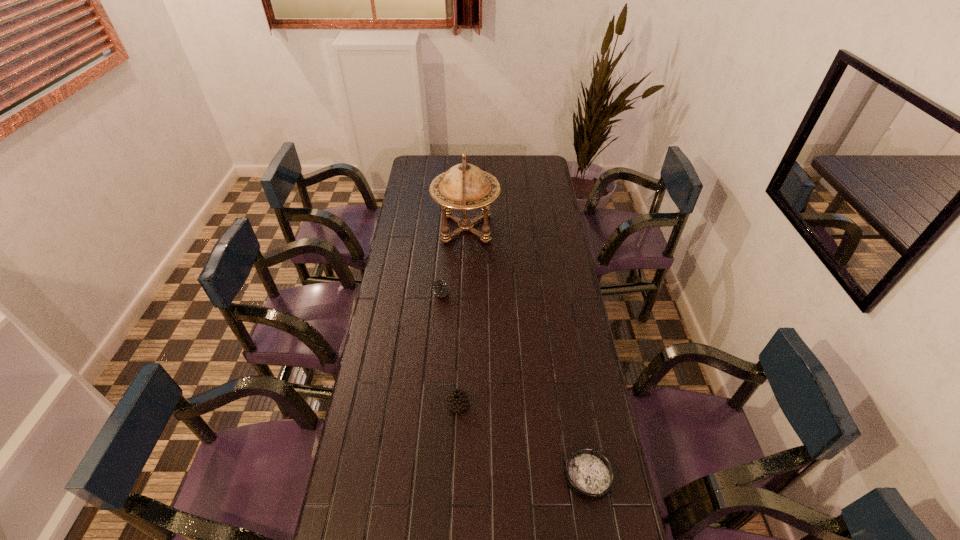
Locate an element on the screen. Image resolution: width=960 pixels, height=540 pixels. vacant space that is in between the globe and the ashtray is located at coordinates (527, 352).

This screenshot has width=960, height=540. In order to click on free spot between the shortest object and the left pinecone in this screenshot , I will do `click(515, 385)`.

I want to click on unoccupied area between the second nearest object and the globe, so click(462, 316).

You are a GUI agent. You are given a task and a screenshot of the screen. Output one action in this format:
    pyautogui.click(x=<x>, y=<y>)
    Task: Click on the blank region between the farther pinecone and the globe
    The width and height of the screenshot is (960, 540).
    Given the screenshot: What is the action you would take?
    pyautogui.click(x=454, y=261)

The height and width of the screenshot is (540, 960). In order to click on empty space that is in between the third farthest object and the farthest object in this screenshot , I will do [x=462, y=316].

Find the location of a particular element. This screenshot has height=540, width=960. vacant area that lies between the farthest object and the ashtray is located at coordinates [x=527, y=352].

What are the coordinates of `vacant space in between the rightmost object and the farther pinecone` in the screenshot? It's located at (515, 385).

Identify the location of object that is the closest one to the farther pinecone. The height and width of the screenshot is (540, 960). (464, 187).

Locate which object is the second closest to the globe. Please provide its 2D coordinates. Your answer should be formatted as a tuple, i.e. [(x, y)], where the tuple contains the x and y coordinates of a point satisfying the conditions above.

[(457, 400)]

Where is `vacant region that satisfies the following two spatial constraints: 1. on the front-facing side of the ashtray; 2. on the right side of the tallest object`? vacant region that satisfies the following two spatial constraints: 1. on the front-facing side of the ashtray; 2. on the right side of the tallest object is located at coordinates (457, 476).